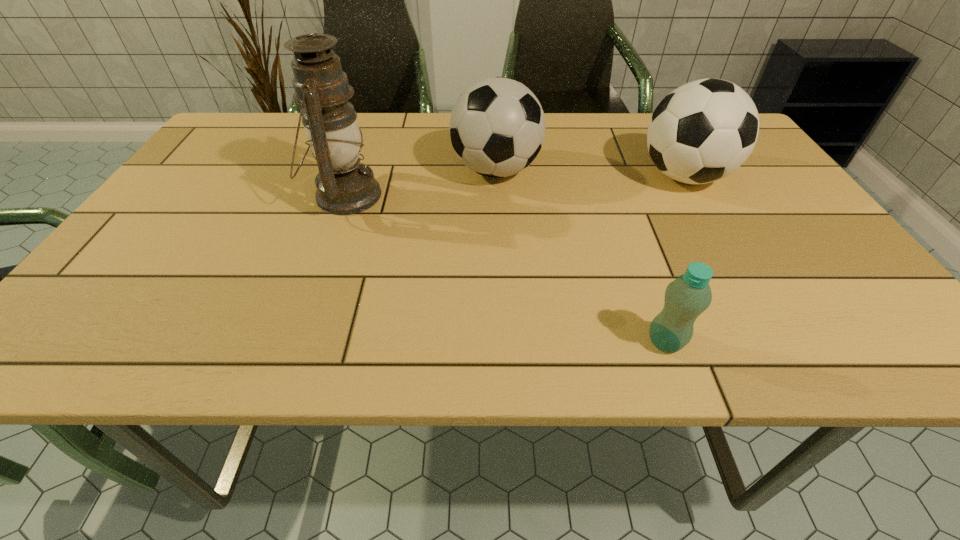
Image resolution: width=960 pixels, height=540 pixels. In order to click on free region located 0.100m at the front cap of the water bottle in this screenshot , I will do `click(588, 342)`.

Find the location of `free space located 0.210m at the front cap of the water bottle`. free space located 0.210m at the front cap of the water bottle is located at coordinates (522, 342).

Locate an element on the screen. The image size is (960, 540). object present at the near edge is located at coordinates (689, 295).

Locate an element on the screen. object situated at the right edge is located at coordinates (701, 132).

Locate an element on the screen. object at the far right corner is located at coordinates (701, 132).

The image size is (960, 540). In order to click on vacant space at the far edge of the desktop in this screenshot , I will do `click(552, 132)`.

In the image, there is a desktop. Where is `vacant space at the near edge`? The height and width of the screenshot is (540, 960). vacant space at the near edge is located at coordinates (481, 321).

Locate an element on the screen. This screenshot has width=960, height=540. vacant space at the left edge of the desktop is located at coordinates (211, 196).

This screenshot has height=540, width=960. In the image, there is a desktop. What are the coordinates of `vacant area at the right edge` in the screenshot? It's located at (815, 296).

Where is `vacant space at the near left corner of the desktop`? This screenshot has height=540, width=960. vacant space at the near left corner of the desktop is located at coordinates (83, 340).